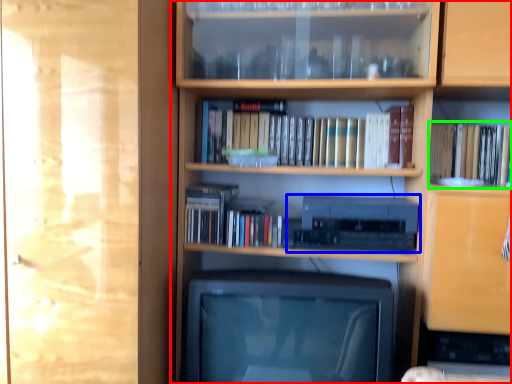
Question: Which object is the farthest from bookcase (highlighted by a red box)? Choose among these: stereo (highlighted by a blue box) or book (highlighted by a green box).

Choices:
 (A) stereo
 (B) book

Answer: (B)